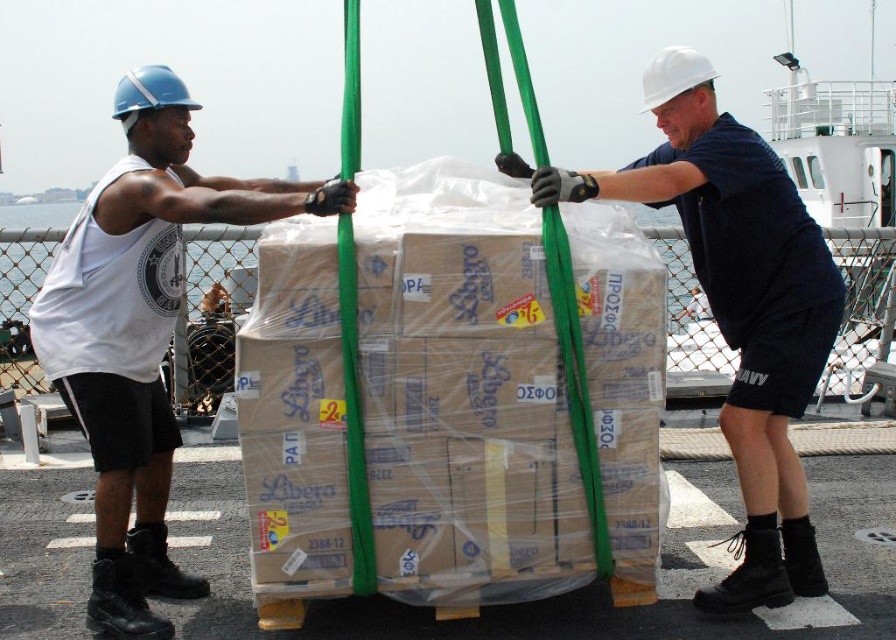
Question: Which is nearer to the white matte helmet at upper center?

Choices:
 (A) white matte tank top at left
 (B) white hard hat at upper center

Answer: (B)

Question: Which point is farther to the camera?

Choices:
 (A) (162, 476)
 (B) (730, 266)

Answer: (A)

Question: Which of the following is the closest to the observer?

Choices:
 (A) white matte tank top at left
 (B) white hard hat at upper center

Answer: (A)

Question: Does white matte tank top at left have a smaller size compared to white hard hat at upper center?

Choices:
 (A) no
 (B) yes

Answer: (B)

Question: Does white matte tank top at left have a larger size compared to white hard hat at upper center?

Choices:
 (A) no
 (B) yes

Answer: (A)

Question: Is white matte tank top at left to the left of white hard hat at upper center from the viewer's perspective?

Choices:
 (A) no
 (B) yes

Answer: (B)